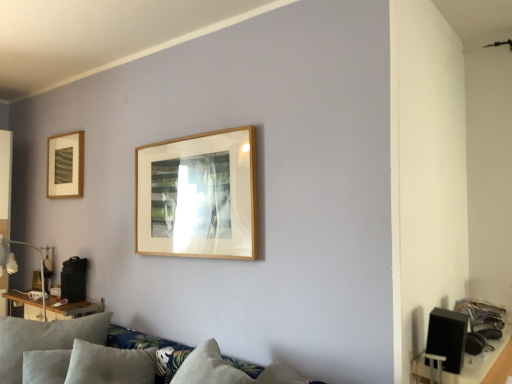
Question: Is matte white lamp at left surrounded by wooden table at left?

Choices:
 (A) yes
 (B) no

Answer: (B)

Question: Is wooden table at left closer to camera compared to matte white lamp at left?

Choices:
 (A) yes
 (B) no

Answer: (B)

Question: Is wooden table at left thinner than matte white lamp at left?

Choices:
 (A) no
 (B) yes

Answer: (B)

Question: Is wooden table at left facing towards matte white lamp at left?

Choices:
 (A) no
 (B) yes

Answer: (A)

Question: Is wooden table at left at the right side of matte white lamp at left?

Choices:
 (A) yes
 (B) no

Answer: (B)

Question: From the image's perspective, is wooden table at left on matte white lamp at left?

Choices:
 (A) yes
 (B) no

Answer: (B)

Question: Is matte gold picture frame at upper left to the left of matte white lamp at left from the viewer's perspective?

Choices:
 (A) no
 (B) yes

Answer: (B)

Question: Is matte gold picture frame at upper left turned away from matte white lamp at left?

Choices:
 (A) yes
 (B) no

Answer: (B)

Question: From a real-world perspective, is matte gold picture frame at upper left under matte white lamp at left?

Choices:
 (A) yes
 (B) no

Answer: (B)

Question: Is matte gold picture frame at upper left at the right side of matte white lamp at left?

Choices:
 (A) no
 (B) yes

Answer: (A)

Question: Considering the relative sizes of matte gold picture frame at upper left and matte white lamp at left in the image provided, is matte gold picture frame at upper left thinner than matte white lamp at left?

Choices:
 (A) no
 (B) yes

Answer: (B)

Question: Is matte gold picture frame at upper left facing towards matte white lamp at left?

Choices:
 (A) no
 (B) yes

Answer: (A)

Question: Is wooden table at left turned away from black matte speaker at lower right?

Choices:
 (A) yes
 (B) no

Answer: (B)